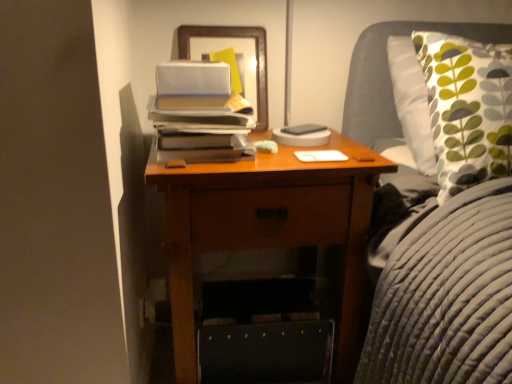
Question: Is wooden picture frame at upper center positioned before wooden nightstand at center?

Choices:
 (A) yes
 (B) no

Answer: (B)

Question: Can you confirm if wooden picture frame at upper center is positioned to the left of wooden nightstand at center?

Choices:
 (A) no
 (B) yes

Answer: (B)

Question: Can you confirm if wooden picture frame at upper center is thinner than wooden nightstand at center?

Choices:
 (A) no
 (B) yes

Answer: (B)

Question: Is wooden picture frame at upper center positioned beyond the bounds of wooden nightstand at center?

Choices:
 (A) yes
 (B) no

Answer: (A)

Question: Is wooden picture frame at upper center behind wooden nightstand at center?

Choices:
 (A) yes
 (B) no

Answer: (A)

Question: From a real-world perspective, is wooden picture frame at upper center positioned under wooden nightstand at center based on gravity?

Choices:
 (A) yes
 (B) no

Answer: (B)

Question: Considering the relative positions of hardcover book at center and wooden nightstand at center in the image provided, is hardcover book at center to the right of wooden nightstand at center from the viewer's perspective?

Choices:
 (A) yes
 (B) no

Answer: (A)

Question: Is hardcover book at center at the left side of wooden nightstand at center?

Choices:
 (A) no
 (B) yes

Answer: (A)

Question: Is hardcover book at center oriented away from wooden nightstand at center?

Choices:
 (A) no
 (B) yes

Answer: (A)

Question: Are hardcover book at center and wooden nightstand at center far apart?

Choices:
 (A) no
 (B) yes

Answer: (A)

Question: Is hardcover book at center wider than wooden nightstand at center?

Choices:
 (A) yes
 (B) no

Answer: (B)

Question: From a real-world perspective, does hardcover book at center stand above wooden nightstand at center?

Choices:
 (A) no
 (B) yes

Answer: (B)

Question: Can you confirm if wooden nightstand at center is thinner than hardcover book at center?

Choices:
 (A) no
 (B) yes

Answer: (A)